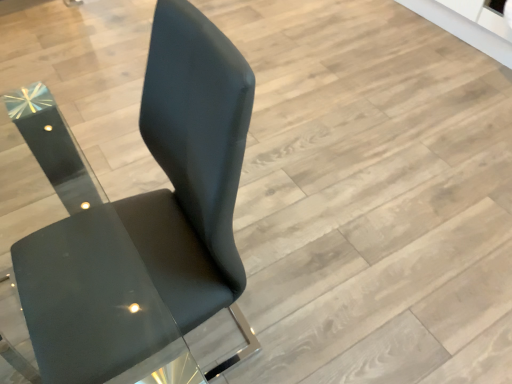
What do you see at coordinates (151, 226) in the screenshot?
I see `matte black chair at center` at bounding box center [151, 226].

The height and width of the screenshot is (384, 512). In order to click on matte black chair at center in this screenshot , I will do `click(151, 226)`.

Identify the location of matte black chair at center. The image size is (512, 384). (151, 226).